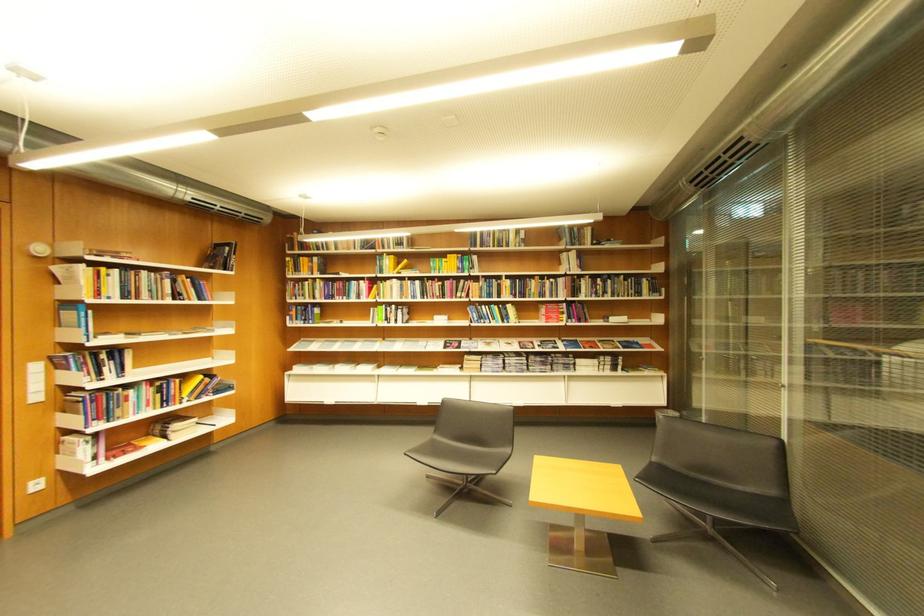
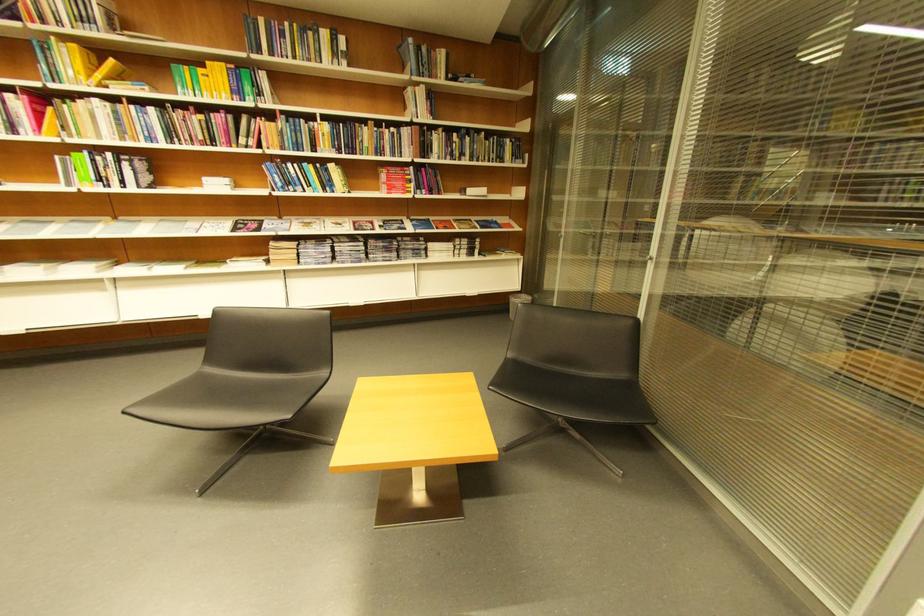
Where in the second image is the point corresponding to point (487, 321) from the first image?

(290, 185)